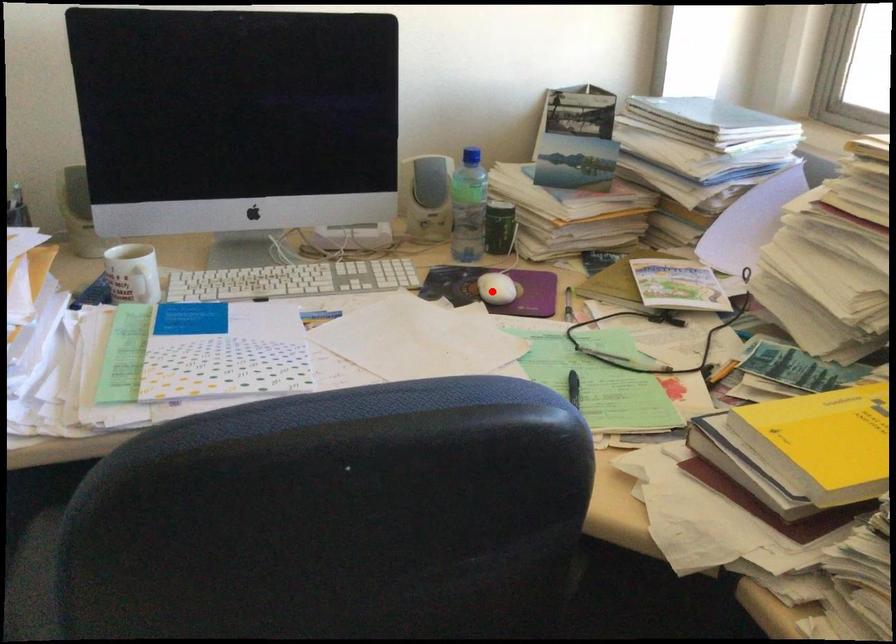
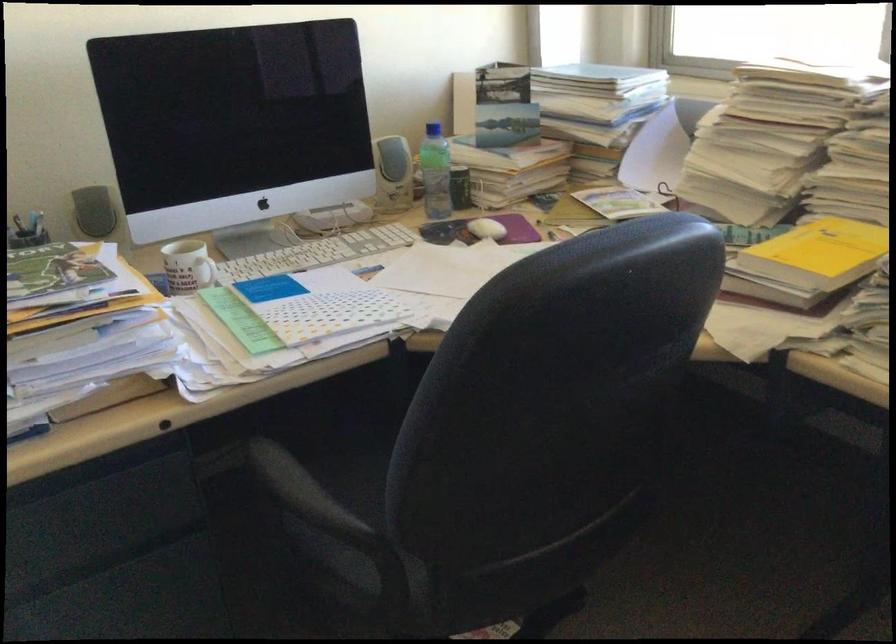
Question: I am providing you with two images of the same scene from different viewpoints. A red point is shown in image1. For the corresponding object point in image2, is it positioned nearer or farther from the camera?

Choices:
 (A) Nearer
 (B) Farther

Answer: (B)